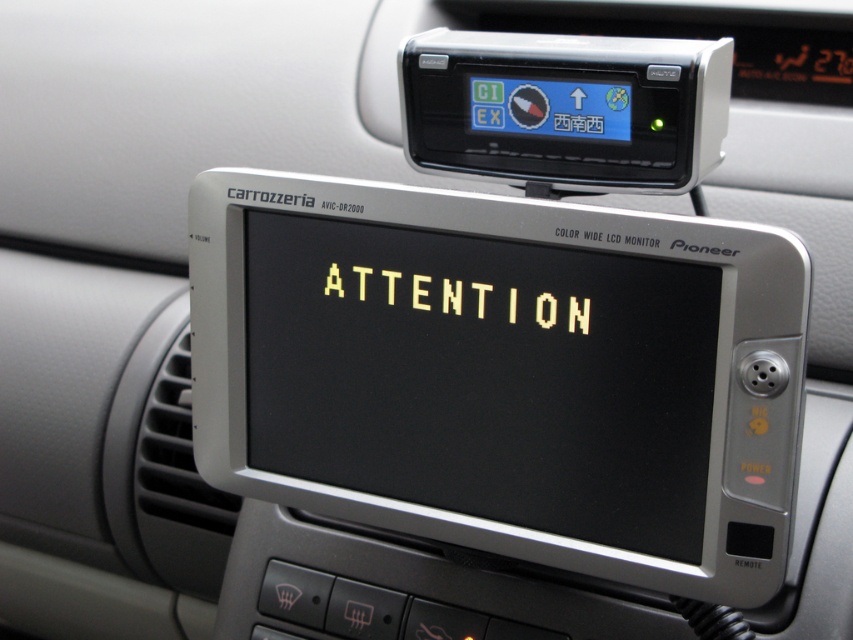
Which is in front, point (691, 164) or point (352, 284)?

Point (691, 164) is more forward.

Find the location of a particular element. The width and height of the screenshot is (853, 640). black plastic gps at upper center is located at coordinates (566, 108).

What do you see at coordinates (566, 108) in the screenshot?
I see `black plastic gps at upper center` at bounding box center [566, 108].

Locate an element on the screen. This screenshot has height=640, width=853. black plastic gps at upper center is located at coordinates (566, 108).